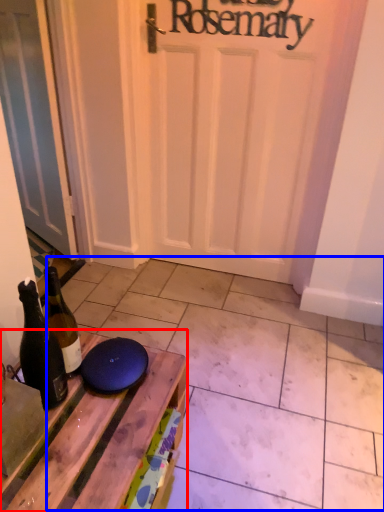
Question: Among these objects, which one is farthest to the camera, table (highlighted by a red box) or tile (highlighted by a blue box)?

Choices:
 (A) table
 (B) tile

Answer: (B)